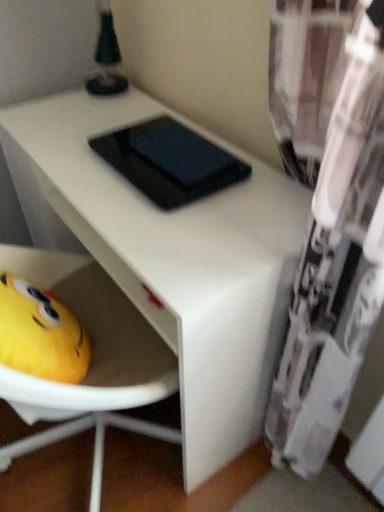
At what (x,y) coordinates should I click in order to perform the action: click on black matte pad at center. Please return your answer as a coordinate pair (x, y). Looking at the image, I should click on (169, 161).

The image size is (384, 512). What do you see at coordinates (169, 161) in the screenshot?
I see `black matte pad at center` at bounding box center [169, 161].

At what (x,y) coordinates should I click in order to perform the action: click on white matte table at center. Please return your answer as a coordinate pair (x, y). This screenshot has height=512, width=384. Looking at the image, I should click on (171, 258).

What do you see at coordinates (171, 258) in the screenshot? I see `white matte table at center` at bounding box center [171, 258].

The image size is (384, 512). I want to click on black matte pad at center, so click(x=169, y=161).

Does black matte pad at center appear on the right side of white matte table at center?

Yes, black matte pad at center is to the right of white matte table at center.

Considering the positions of objects black matte pad at center and white matte table at center in the image provided, who is behind, black matte pad at center or white matte table at center?

black matte pad at center is further away from the camera.

Does point (103, 140) lie behind point (97, 244)?

Yes.

From the image's perspective, is black matte pad at center above or below white matte table at center?

black matte pad at center is situated higher than white matte table at center in the image.

From a real-world perspective, is black matte pad at center physically located above or below white matte table at center?

black matte pad at center is above white matte table at center.

Can you confirm if black matte pad at center is thinner than white matte table at center?

Correct, the width of black matte pad at center is less than that of white matte table at center.

From their relative heights in the image, would you say black matte pad at center is taller or shorter than white matte table at center?

Considering their sizes, black matte pad at center has less height than white matte table at center.

Can you confirm if black matte pad at center is bigger than white matte table at center?

No.

Is white matte table at center surrounded by black matte pad at center?

No, white matte table at center is not inside black matte pad at center.

Is black matte pad at center placed right next to white matte table at center?

They are not placed beside each other.

Is black matte pad at center oriented away from white matte table at center?

black matte pad at center is not turned away from white matte table at center.

How different are the orientations of black matte pad at center and white matte table at center in degrees?

black matte pad at center and white matte table at center are facing 0.149 degrees away from each other.

This screenshot has width=384, height=512. I want to click on pad above the white matte table at center (from the image's perspective), so (x=169, y=161).

Does white matte table at center appear on the right side of black matte pad at center?

No.

Is white matte table at center closer to the viewer compared to black matte pad at center?

That is True.

Is point (110, 208) less distant than point (187, 136)?

Yes.

In the scene shown: From the image's perspective, is white matte table at center positioned above or below black matte pad at center?

From the image's perspective, white matte table at center appears below black matte pad at center.

From a real-world perspective, is white matte table at center positioned above or below black matte pad at center?

From a real-world perspective, white matte table at center is physically below black matte pad at center.

Between white matte table at center and black matte pad at center, which one has larger width?

white matte table at center.

Between white matte table at center and black matte pad at center, which one has more height?

white matte table at center.

Based on their sizes in the image, would you say white matte table at center is bigger or smaller than black matte pad at center?

white matte table at center is bigger than black matte pad at center.

Looking at this image, is white matte table at center situated inside black matte pad at center or outside?

white matte table at center is located beyond the bounds of black matte pad at center.

Is the surface of white matte table at center in direct contact with black matte pad at center?

No.

Is white matte table at center oriented towards black matte pad at center?

No, white matte table at center does not turn towards black matte pad at center.

How different are the orientations of white matte table at center and black matte pad at center in degrees?

0.149 degrees.

How far apart are white matte table at center and black matte pad at center?

The distance of white matte table at center from black matte pad at center is 7.43 inches.

Find the location of `table that appears in front of the black matte pad at center`. table that appears in front of the black matte pad at center is located at coordinates (171, 258).

This screenshot has height=512, width=384. In order to click on table that is on the left side of black matte pad at center in this screenshot , I will do `click(171, 258)`.

You are a GUI agent. You are given a task and a screenshot of the screen. Output one action in this format:
    pyautogui.click(x=<x>, y=<y>)
    Task: Click on the table below the black matte pad at center (from a real-world perspective)
    
    Given the screenshot: What is the action you would take?
    pyautogui.click(x=171, y=258)